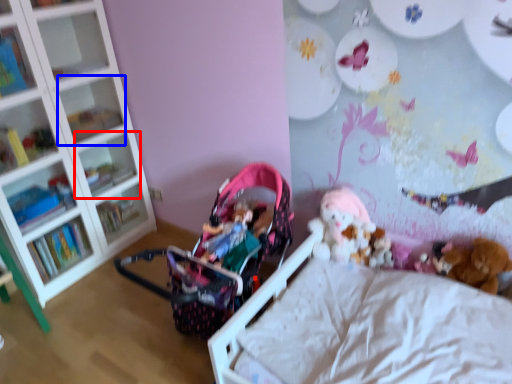
Question: Which point is closer to the camera, shelf (highlighted by a red box) or shelf (highlighted by a blue box)?

Choices:
 (A) shelf
 (B) shelf

Answer: (B)